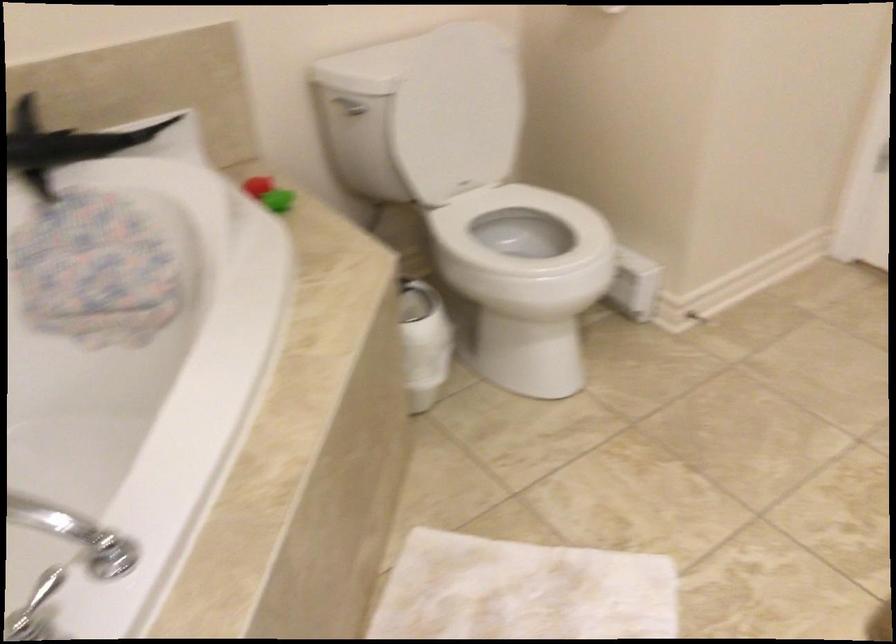
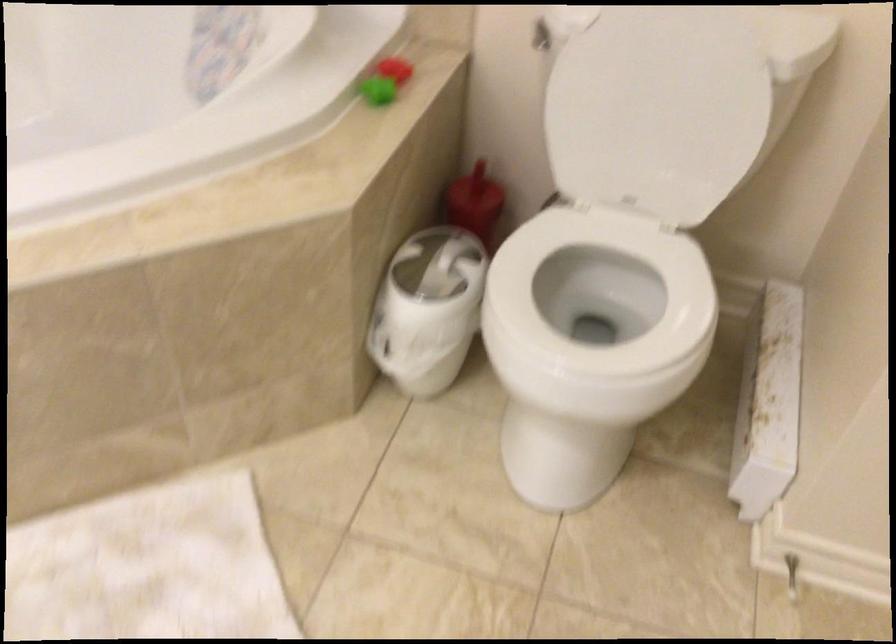
Where in the second image is the point corresponding to (x=431, y=323) from the first image?

(427, 308)